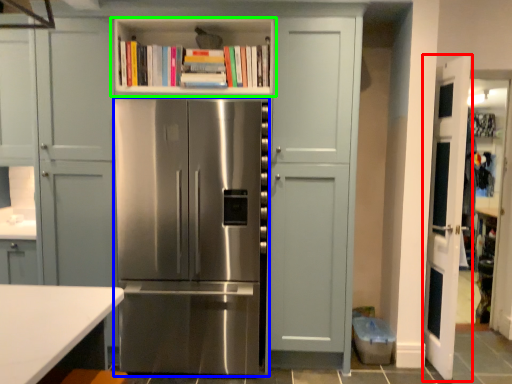
Question: Estimate the real-world distances between objects in this image. Which object is closer to door (highlighted by a red box), refrigerator (highlighted by a blue box) or shelf (highlighted by a green box)?

Choices:
 (A) refrigerator
 (B) shelf

Answer: (A)